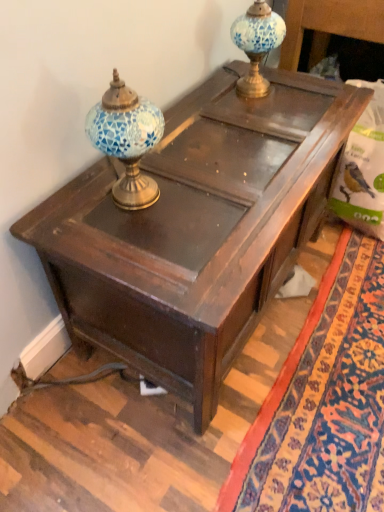
Image resolution: width=384 pixels, height=512 pixels. In order to click on vacant region above wooden table at center (from a real-world perspective) in this screenshot , I will do `click(234, 150)`.